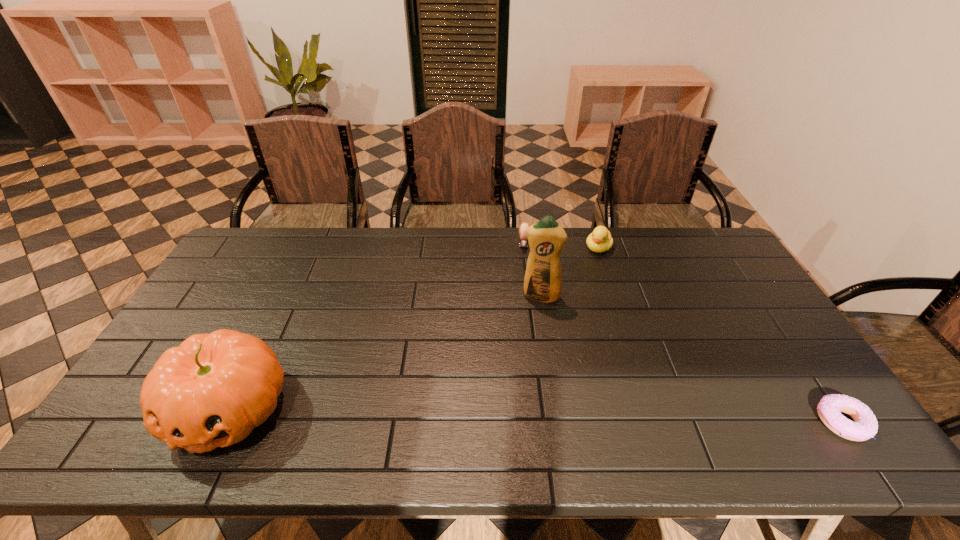
Where is `free space at the far left corner of the desktop`? free space at the far left corner of the desktop is located at coordinates (279, 234).

Identify the location of vacant space in between the third nearest object and the rightmost object. (691, 359).

The image size is (960, 540). Find the location of `free space between the rightmost object and the pumpkin`. free space between the rightmost object and the pumpkin is located at coordinates (536, 415).

Identify the location of vacant region between the escargot and the shortest object. The width and height of the screenshot is (960, 540). (684, 333).

Locate an element on the screen. Image resolution: width=960 pixels, height=540 pixels. vacant space in between the shortest object and the second tallest object is located at coordinates (536, 415).

Identify the location of free space between the doughnut and the fourth object from left to right. The image size is (960, 540). (x=720, y=335).

Where is `free space between the shortest object and the fourth tallest object`? This screenshot has width=960, height=540. free space between the shortest object and the fourth tallest object is located at coordinates (684, 333).

Where is `free space between the escargot and the pumpkin`? This screenshot has height=540, width=960. free space between the escargot and the pumpkin is located at coordinates point(376,326).

Locate an element on the screen. free point between the fourth tallest object and the second tallest object is located at coordinates (376, 326).

Locate an element on the screen. This screenshot has height=540, width=960. object that can be found as the third closest to the doughnut is located at coordinates (523, 242).